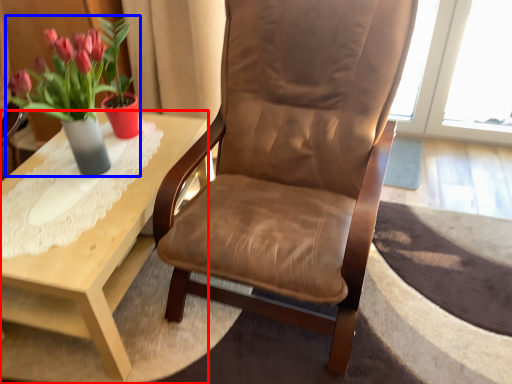
Question: Among these objects, which one is farthest to the camera, coffee table (highlighted by a red box) or houseplant (highlighted by a blue box)?

Choices:
 (A) coffee table
 (B) houseplant

Answer: (A)